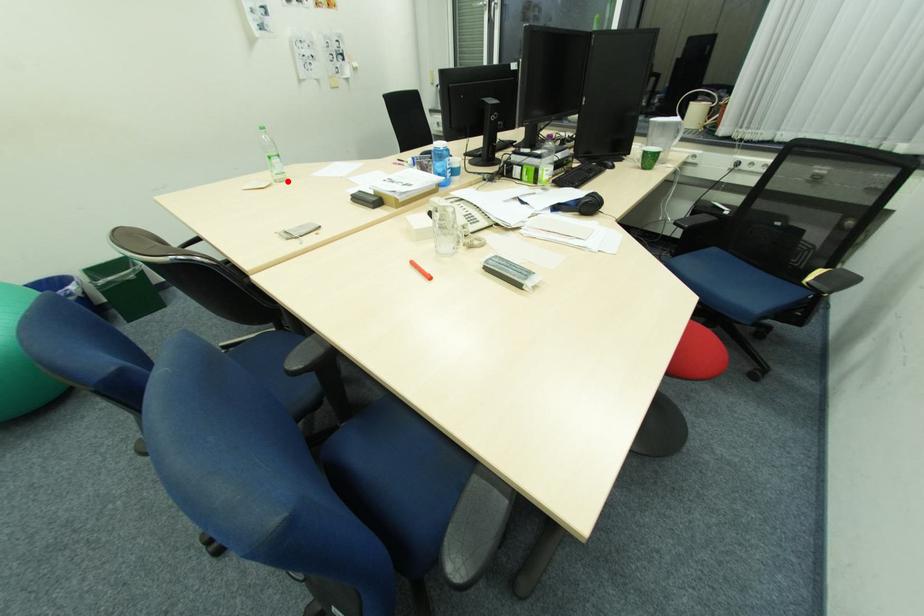
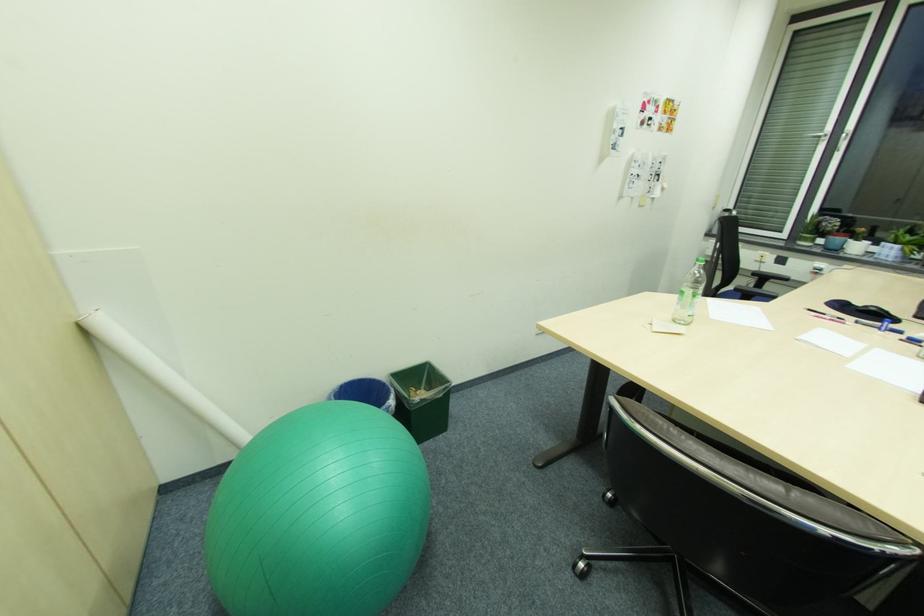
Find the pixel in the second image that matches the highlighted location in the first image.

(688, 323)